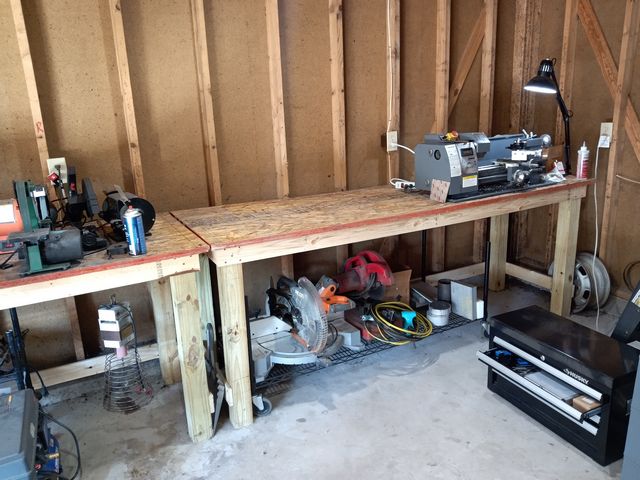
I want to click on electric socket, so click(x=61, y=169).